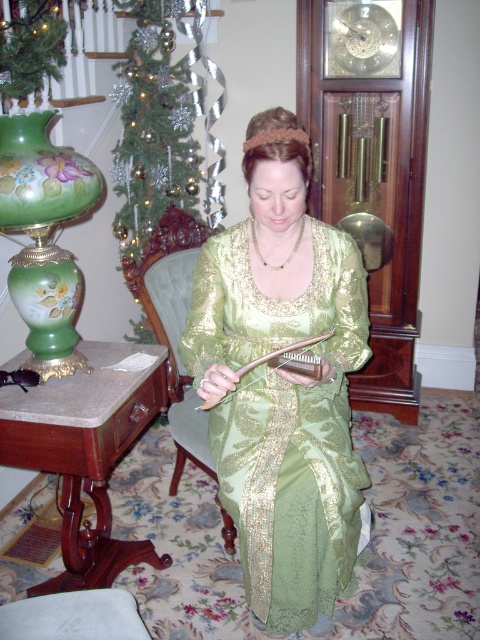
Is green satin dress at center taller than gold chain necklace at center?

Yes.

Which is in front, point (260, 401) or point (301, 227)?

Point (301, 227) is in front.

The image size is (480, 640). What are the coordinates of `green satin dress at center` in the screenshot? It's located at (284, 413).

In the scene shown: Can you confirm if green satin dress at center is shorter than green fabric armchair at center?

In fact, green satin dress at center may be taller than green fabric armchair at center.

Based on the photo, does green satin dress at center appear over green fabric armchair at center?

Correct, green satin dress at center is located above green fabric armchair at center.

Who is more forward, [272,253] or [173,481]?

Point [272,253]

At what (x,y) coordinates should I click in order to perform the action: click on green satin dress at center. Please return your answer as a coordinate pair (x, y). This screenshot has height=640, width=480. Looking at the image, I should click on (284, 413).

Based on the photo, does green fabric armchair at center have a greater width compared to gold chain necklace at center?

Correct, the width of green fabric armchair at center exceeds that of gold chain necklace at center.

Which is more to the left, green fabric armchair at center or gold chain necklace at center?

green fabric armchair at center is more to the left.

Which is in front, point (145, 244) or point (252, 220)?

Point (252, 220) is more forward.

Find the location of a particular element. This screenshot has width=480, height=640. green fabric armchair at center is located at coordinates (172, 321).